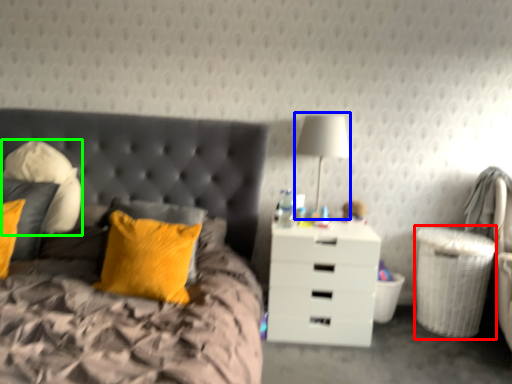
Question: Which is nearer to the laundry basket (highlighted by a red box)? bedside lamp (highlighted by a blue box) or pillow (highlighted by a green box).

Choices:
 (A) bedside lamp
 (B) pillow

Answer: (A)